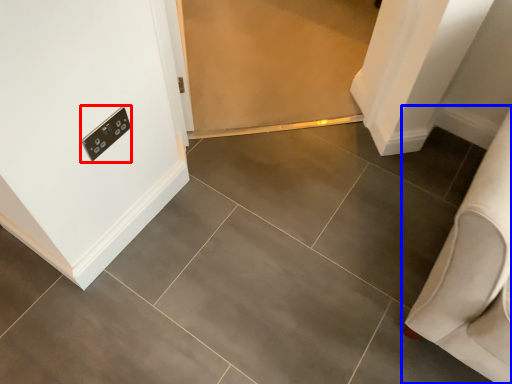
Question: Among these objects, which one is nearest to the camera, light switch (highlighted by a red box) or furniture (highlighted by a blue box)?

Choices:
 (A) light switch
 (B) furniture

Answer: (B)